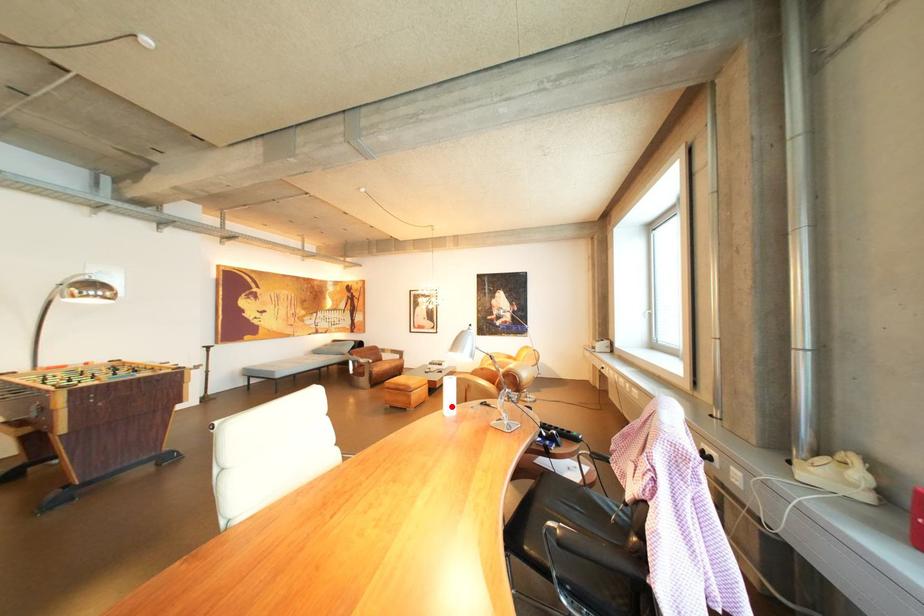
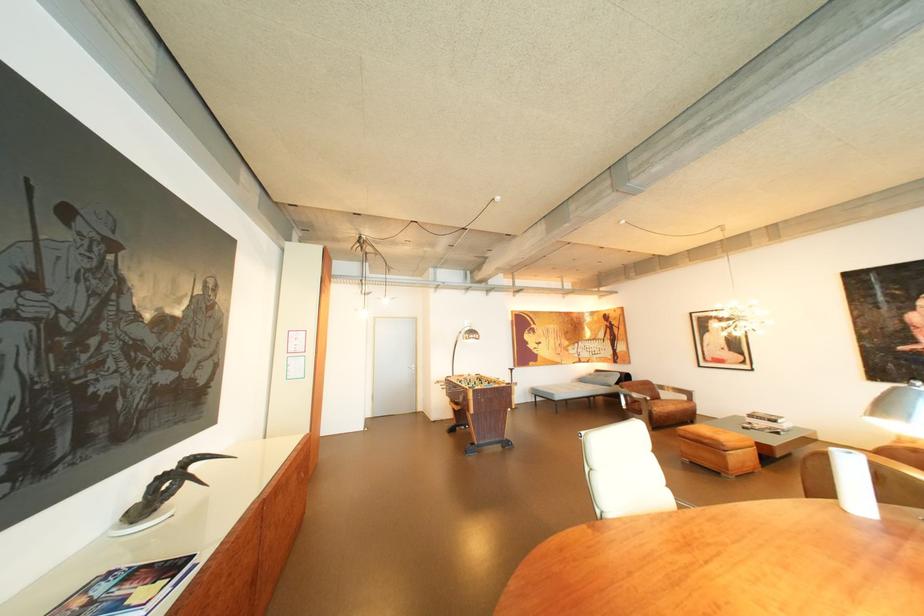
Locate, in the second image, the point that corresponds to the highlighted location in the first image.

(839, 491)